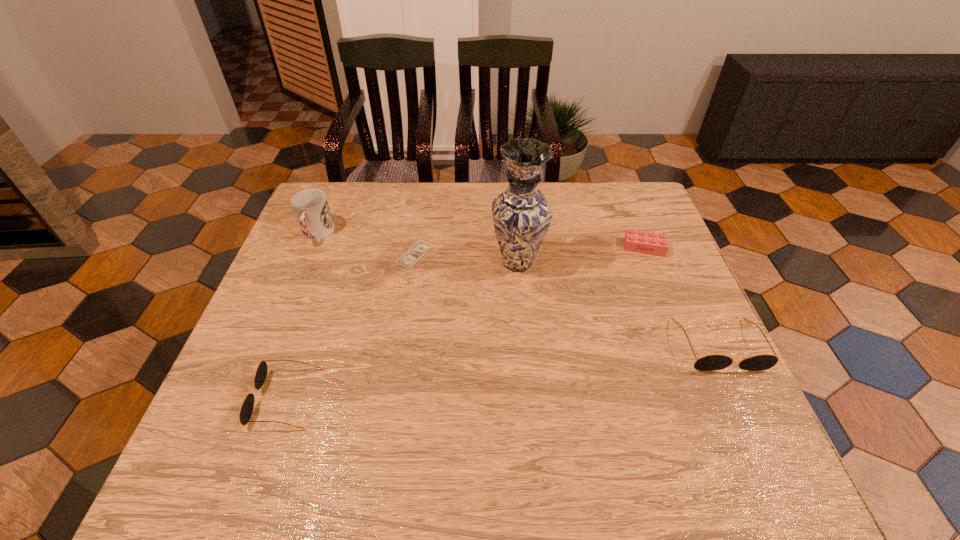
You are a GUI agent. You are given a task and a screenshot of the screen. Output one action in this format:
    pyautogui.click(x=<x>, y=<y>)
    Task: Click on the sunglasses positioned at the right edge
    The width and height of the screenshot is (960, 540).
    Given the screenshot: What is the action you would take?
    pyautogui.click(x=713, y=362)

Locate an element on the screen. This screenshot has width=960, height=540. Lego that is positioned at the right edge is located at coordinates (653, 243).

In order to click on object present at the far left corner in this screenshot , I will do `click(311, 209)`.

Find the location of a particular element. This screenshot has width=960, height=540. object located at the near left corner is located at coordinates (246, 410).

The image size is (960, 540). In the image, there is a desktop. Find the location of `vacant space at the far edge`. vacant space at the far edge is located at coordinates (370, 201).

In the image, there is a desktop. At what (x,y) coordinates should I click in order to perform the action: click on free space at the near edge. Please return your answer as a coordinate pair (x, y). The image size is (960, 540). Looking at the image, I should click on (444, 415).

Identify the location of free location at the left edge of the desktop. (305, 291).

This screenshot has width=960, height=540. In order to click on free region at the right edge in this screenshot , I will do `click(612, 238)`.

Locate an element on the screen. The image size is (960, 540). vacant region at the near left corner of the desktop is located at coordinates (291, 404).

Image resolution: width=960 pixels, height=540 pixels. Identify the location of free space at the far right corner. (597, 192).